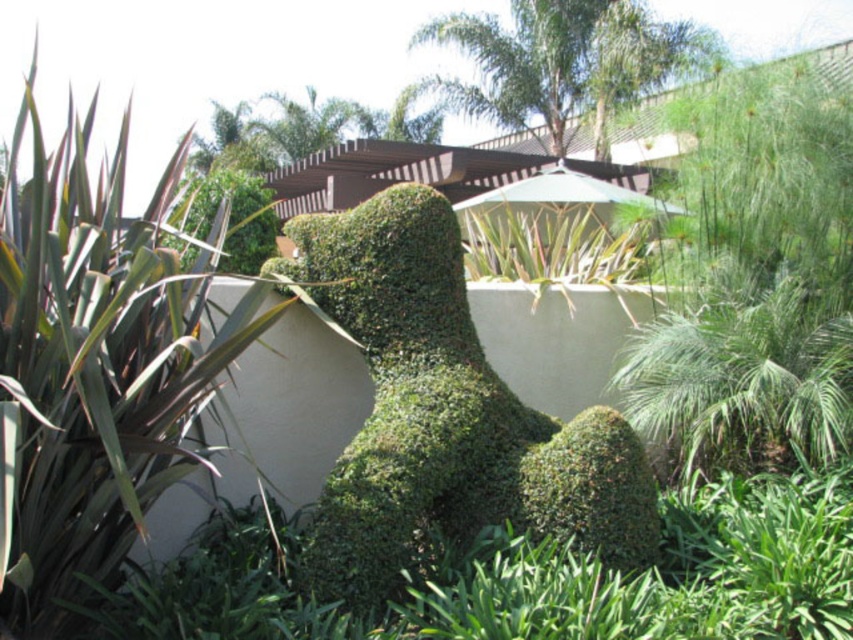
You are a gardener who wants to plant a new shrub in this garden. You have a small shrub that needs a spot where there is space for it to grow. Looking at the green leafy bush at left and the green leafy bush at center, which one would you choose to place the new shrub next to and why?

You should place the new shrub next to the green leafy bush at center because it is smaller in size than the green leafy bush at left, leaving more space for the new shrub to grow.

You are standing in the garden and want to place a small decorative statue exactly at point (99, 360). What object is located at that point?

The point (99, 360) is occupied by the green leafy bush at left.